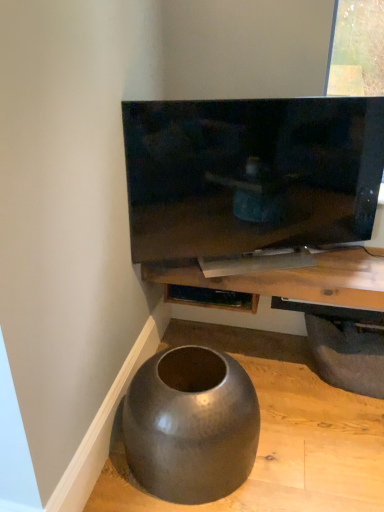
Question: From the image's perspective, is matte gray concrete at lower left positioned above or below wooden shelf at center?

Choices:
 (A) below
 (B) above

Answer: (A)

Question: From a real-world perspective, relative to wooden shelf at center, is matte gray concrete at lower left vertically above or below?

Choices:
 (A) above
 (B) below

Answer: (B)

Question: Estimate the real-world distances between objects in this image. Which object is closer to the wooden shelf at center?

Choices:
 (A) matte black tv at upper center
 (B) matte gray concrete at lower left
 (C) dark gray rubber tire at lower right
 (D) matte black shelf at lower center

Answer: (D)

Question: Estimate the real-world distances between objects in this image. Which object is closer to the matte black shelf at lower center?

Choices:
 (A) dark gray rubber tire at lower right
 (B) matte gray concrete at lower left
 (C) matte black tv at upper center
 (D) wooden shelf at center

Answer: (D)